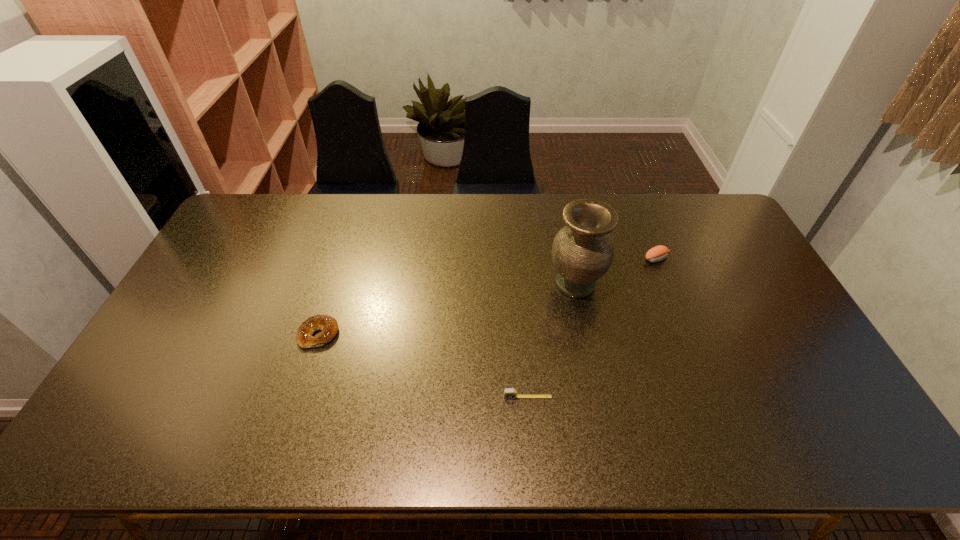
Identify the location of empty space that is in between the third object from left to right and the tape measure. This screenshot has width=960, height=540. (552, 340).

This screenshot has width=960, height=540. I want to click on empty space that is in between the second object from right to left and the tape measure, so 552,340.

The image size is (960, 540). I want to click on free space between the tape measure and the tallest object, so click(x=552, y=340).

Identify the location of empty location between the second object from left to right and the third shortest object. (592, 328).

In order to click on free space that is in between the tape measure and the vase in this screenshot , I will do `click(552, 340)`.

At what (x,y) coordinates should I click in order to perform the action: click on vacant space that's between the tape measure and the rightmost object. Please return your answer as a coordinate pair (x, y). The height and width of the screenshot is (540, 960). Looking at the image, I should click on (592, 328).

Locate an element on the screen. Image resolution: width=960 pixels, height=540 pixels. empty location between the leftmost object and the vase is located at coordinates (447, 309).

Locate an element on the screen. This screenshot has height=540, width=960. object that is the closest one to the second nearest object is located at coordinates (509, 393).

Locate which object is the closest to the third object from right to left. Please provide its 2D coordinates. Your answer should be formatted as a tuple, i.e. [(x, y)], where the tuple contains the x and y coordinates of a point satisfying the conditions above.

[(582, 252)]

Identify the location of vacant space that satisfies the following two spatial constraints: 1. on the back side of the sushi; 2. on the left side of the second object from right to left. (570, 259).